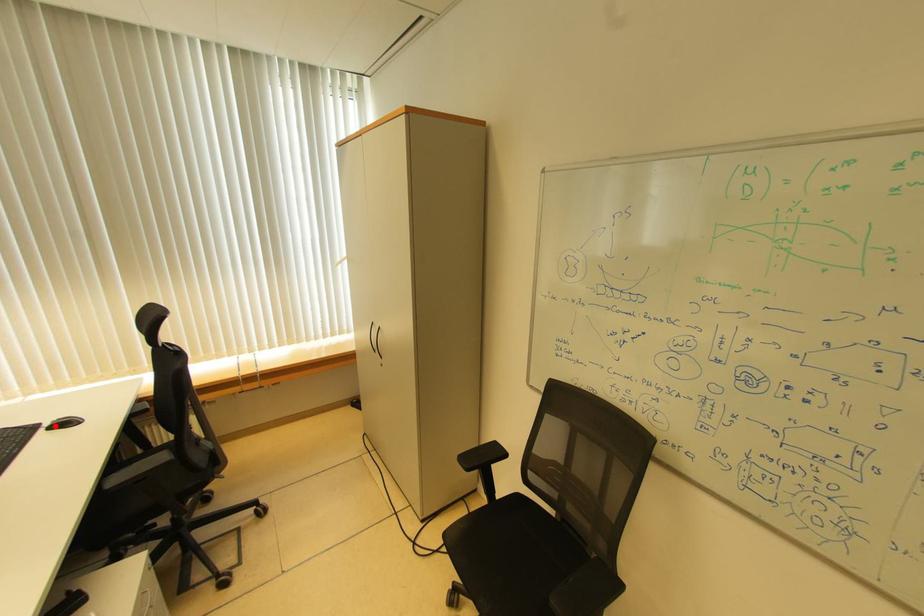
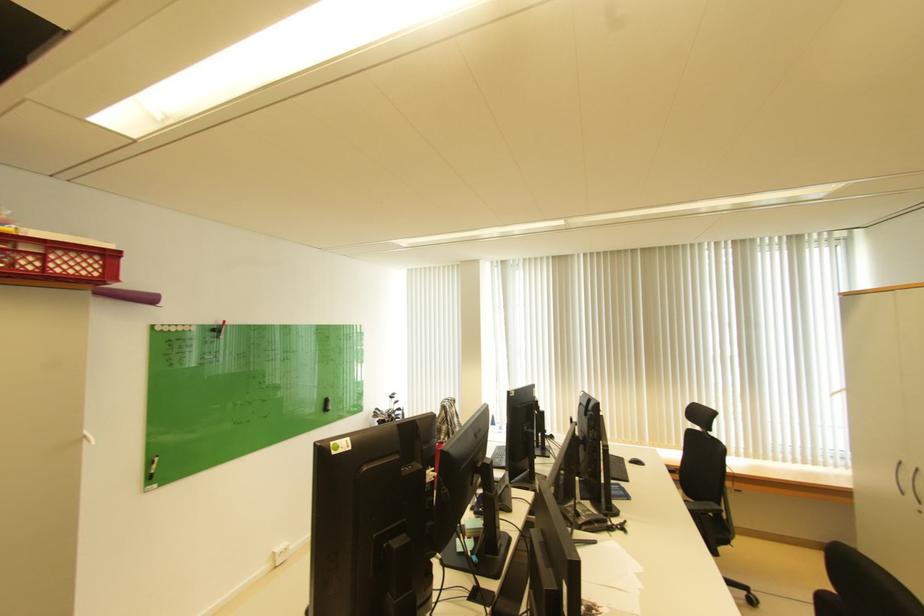
Question: I am providing you with two images of the same scene from different viewpoints. Image1 has a red point marked. In image2, the corresponding 3D location appears at what relative position? Reply with the corresponding letter.

Choices:
 (A) Closer
 (B) Farther

Answer: (A)